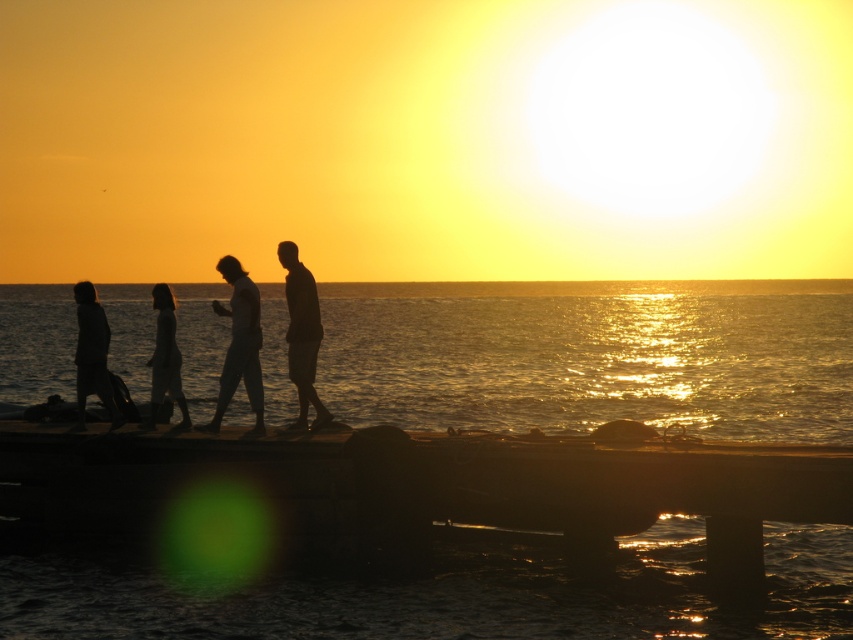
Image resolution: width=853 pixels, height=640 pixels. What do you see at coordinates (426, 483) in the screenshot?
I see `smooth concrete dock at center` at bounding box center [426, 483].

Is the position of smooth concrete dock at center more distant than that of silhouette figure at center?

No, it is in front of silhouette figure at center.

This screenshot has height=640, width=853. In order to click on smooth concrete dock at center in this screenshot , I will do `click(426, 483)`.

Is point (697, 490) in front of point (91, 387)?

Yes, point (697, 490) is in front of point (91, 387).

Can you confirm if smooth concrete dock at center is smaller than silhouette dress at left?

Indeed, smooth concrete dock at center has a smaller size compared to silhouette dress at left.

Between point (791, 506) and point (86, 316), which one is positioned behind?

Point (86, 316)

Locate an element on the screen. smooth concrete dock at center is located at coordinates (426, 483).

Is smooth concrete dock at center taller than silhouette dress at center?

Indeed, smooth concrete dock at center has a greater height compared to silhouette dress at center.

Is point (344, 442) positioned after point (160, 336)?

No, (344, 442) is closer to viewer.

This screenshot has width=853, height=640. What do you see at coordinates (426, 483) in the screenshot?
I see `smooth concrete dock at center` at bounding box center [426, 483].

The image size is (853, 640). Find the location of `smooth concrete dock at center`. smooth concrete dock at center is located at coordinates (426, 483).